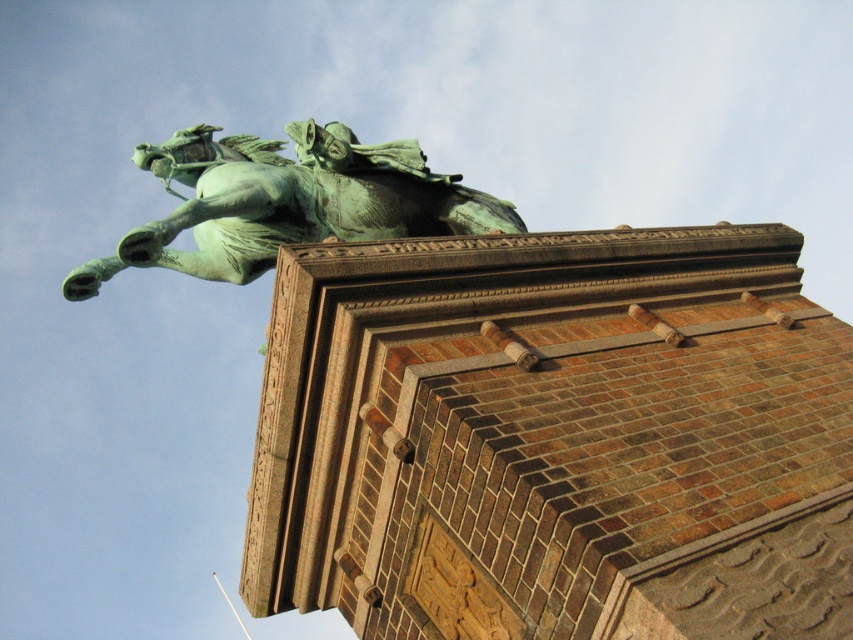
Question: Among these points, which one is farthest from the camera?

Choices:
 (A) (622, 392)
 (B) (374, 230)

Answer: (B)

Question: Among these objects, which one is nearest to the camera?

Choices:
 (A) brown brick tower at upper center
 (B) green patina statue at upper center

Answer: (A)

Question: Is brown brick tower at upper center above green patina statue at upper center?

Choices:
 (A) no
 (B) yes

Answer: (A)

Question: Is brown brick tower at upper center above green patina statue at upper center?

Choices:
 (A) yes
 (B) no

Answer: (B)

Question: Which of the following is the farthest from the observer?

Choices:
 (A) (235, 202)
 (B) (761, 570)

Answer: (A)

Question: Is brown brick tower at upper center to the right of green patina statue at upper center from the viewer's perspective?

Choices:
 (A) yes
 (B) no

Answer: (A)